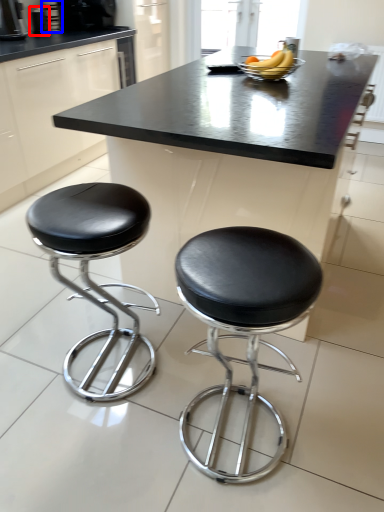
Question: Which object is further to the camera taking this photo, appliance (highlighted by a red box) or appliance (highlighted by a blue box)?

Choices:
 (A) appliance
 (B) appliance

Answer: (B)